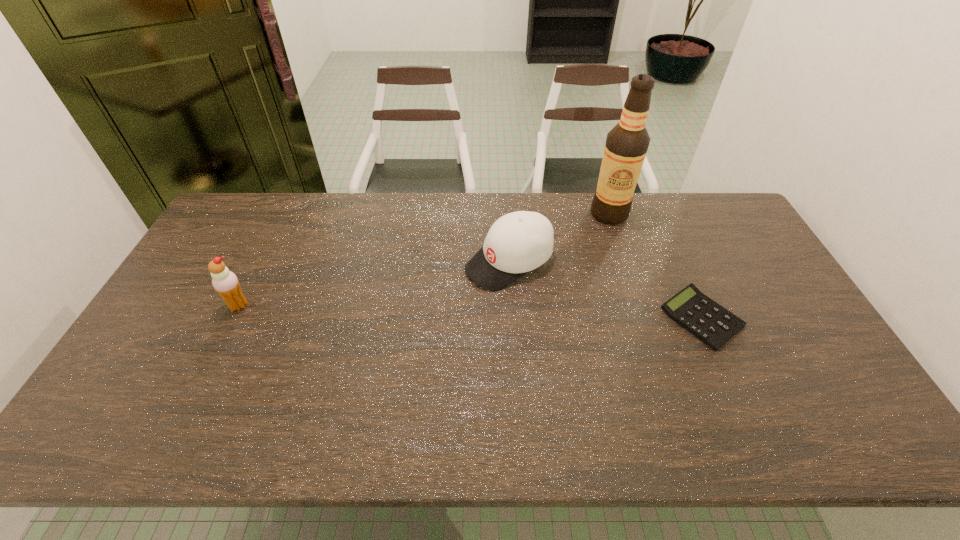
Where is `vacant area at the far right corner of the desktop`? The width and height of the screenshot is (960, 540). vacant area at the far right corner of the desktop is located at coordinates (708, 218).

In order to click on free space between the calculator and the farthest object in this screenshot , I will do `click(656, 266)`.

Identify the location of vacant area that lies between the baseball cap and the leftmost object. The height and width of the screenshot is (540, 960). (373, 284).

Locate an element on the screen. This screenshot has width=960, height=540. free space between the shortest object and the alcohol is located at coordinates (656, 266).

Identify the location of vacant space that's between the calculator and the alcohol. (656, 266).

In order to click on free space between the alcohol and the second tallest object in this screenshot , I will do `click(424, 260)`.

In order to click on vacant area between the third tallest object and the shortest object in this screenshot , I will do `click(605, 290)`.

Where is `free space between the tallest object and the calculator`? This screenshot has width=960, height=540. free space between the tallest object and the calculator is located at coordinates (656, 266).

Where is `free space between the farthest object and the icecream`? The image size is (960, 540). free space between the farthest object and the icecream is located at coordinates (424, 260).

Find the location of a particular element. free space between the shortest object and the farthest object is located at coordinates [x=656, y=266].